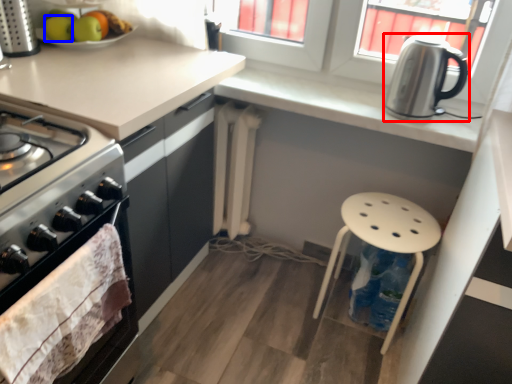
Question: Which of the following is the farthest to the observer, kettle (highlighted by a red box) or apple (highlighted by a blue box)?

Choices:
 (A) kettle
 (B) apple

Answer: (B)